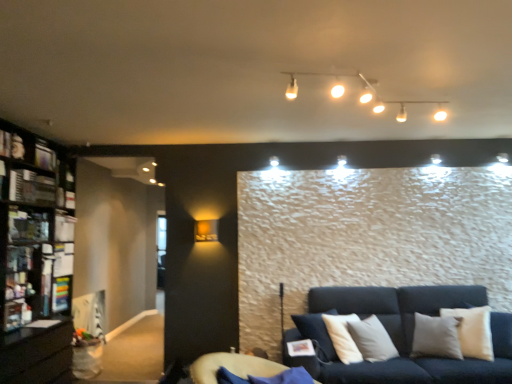
Question: Is metallic silver shelf at left, the first shelf from the front, shorter than white glossy track lights at upper center, marked as the first lamp in a front-to-back arrangement?

Choices:
 (A) no
 (B) yes

Answer: (A)

Question: From a real-world perspective, is metallic silver shelf at left, the first shelf in the top-to-bottom sequence, positioned over white glossy track lights at upper center, marked as the first lamp in a front-to-back arrangement, based on gravity?

Choices:
 (A) yes
 (B) no

Answer: (B)

Question: Considering the relative positions of metallic silver shelf at left, the first shelf from the front, and white glossy track lights at upper center, marked as the first lamp in a front-to-back arrangement, in the image provided, is metallic silver shelf at left, the first shelf from the front, in front of white glossy track lights at upper center, marked as the first lamp in a front-to-back arrangement,?

Choices:
 (A) yes
 (B) no

Answer: (B)

Question: Considering the relative positions of metallic silver shelf at left, the first shelf from the front, and white glossy track lights at upper center, which is the 2th lamp from bottom to top, in the image provided, is metallic silver shelf at left, the first shelf from the front, to the left of white glossy track lights at upper center, which is the 2th lamp from bottom to top, from the viewer's perspective?

Choices:
 (A) yes
 (B) no

Answer: (A)

Question: Is metallic silver shelf at left, arranged as the 2th shelf when viewed from the back, placed right next to white glossy track lights at upper center, which is the 2th lamp from bottom to top?

Choices:
 (A) no
 (B) yes

Answer: (A)

Question: From the image's perspective, would you say metallic silver shelf at left, the first shelf in the top-to-bottom sequence, is positioned over white glossy track lights at upper center, which ranks as the first lamp in right-to-left order?

Choices:
 (A) no
 (B) yes

Answer: (A)

Question: Can you confirm if white glossy track lights at upper center, the second lamp in the left-to-right sequence, is bigger than black wooden bookcase at left?

Choices:
 (A) no
 (B) yes

Answer: (A)

Question: From a real-world perspective, is white glossy track lights at upper center, which is the 1th lamp in top-to-bottom order, positioned over black wooden bookcase at left based on gravity?

Choices:
 (A) yes
 (B) no

Answer: (A)

Question: Considering the relative sizes of white glossy track lights at upper center, which is the 2th lamp from bottom to top, and black wooden bookcase at left in the image provided, is white glossy track lights at upper center, which is the 2th lamp from bottom to top, taller than black wooden bookcase at left?

Choices:
 (A) no
 (B) yes

Answer: (A)

Question: Is white glossy track lights at upper center, which is the 2th lamp from bottom to top, wider than black wooden bookcase at left?

Choices:
 (A) yes
 (B) no

Answer: (B)

Question: Does white glossy track lights at upper center, which ranks as the first lamp in right-to-left order, touch black wooden bookcase at left?

Choices:
 (A) yes
 (B) no

Answer: (B)

Question: Is white glossy track lights at upper center, the second lamp in the left-to-right sequence, surrounding black wooden bookcase at left?

Choices:
 (A) no
 (B) yes

Answer: (A)

Question: Can you see metallic silver shelf at left, positioned as the second shelf in bottom-to-top order, touching velvet blue futon at lower center?

Choices:
 (A) no
 (B) yes

Answer: (A)